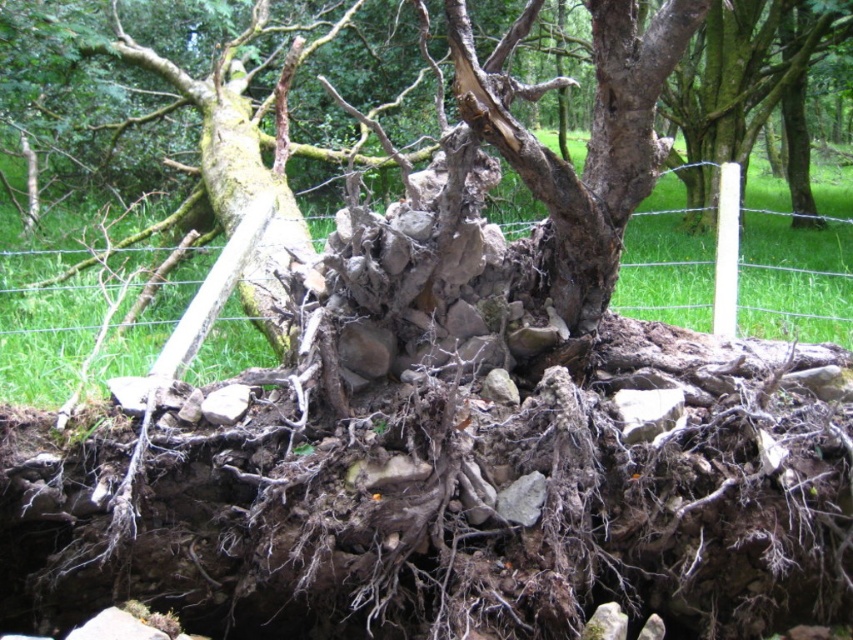
Question: Can you confirm if brown rough bark tree at center is wider than green mossy bark at center?

Choices:
 (A) yes
 (B) no

Answer: (A)

Question: Which point appears closest to the camera in this image?

Choices:
 (A) (270, 284)
 (B) (221, 99)

Answer: (A)

Question: Does brown rough bark tree at center lie behind green mossy bark at center?

Choices:
 (A) no
 (B) yes

Answer: (A)

Question: Which object is farther from the camera taking this photo?

Choices:
 (A) brown rough bark tree at center
 (B) green mossy bark at center

Answer: (B)

Question: Does brown rough bark tree at center come behind green mossy bark at center?

Choices:
 (A) no
 (B) yes

Answer: (A)